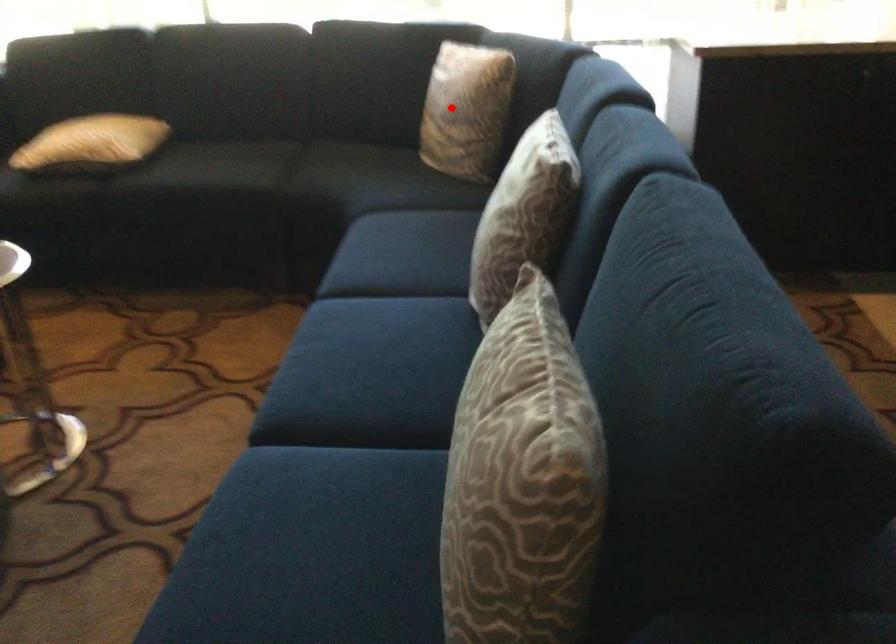
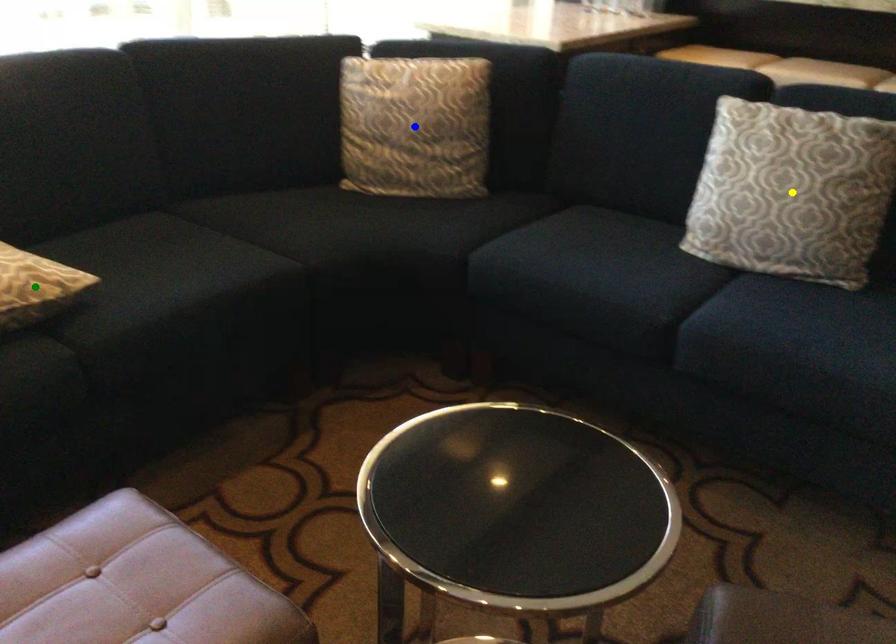
Question: I am providing you with two images of the same scene from different viewpoints. A red point is marked on the first image. You are given multiple points on the second image. Which spot in image 2 lines up with the point in image 1?

Choices:
 (A) blue point
 (B) yellow point
 (C) green point

Answer: (A)